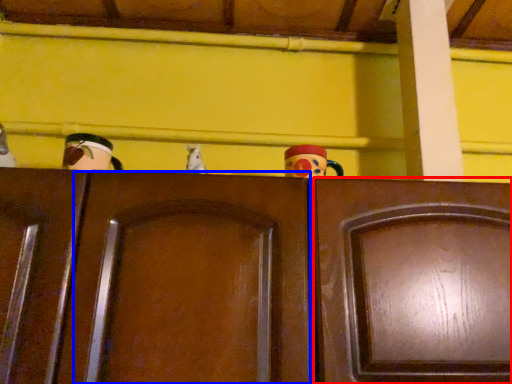
Question: Which point is further to the camera, door (highlighted by a red box) or door (highlighted by a blue box)?

Choices:
 (A) door
 (B) door

Answer: (A)